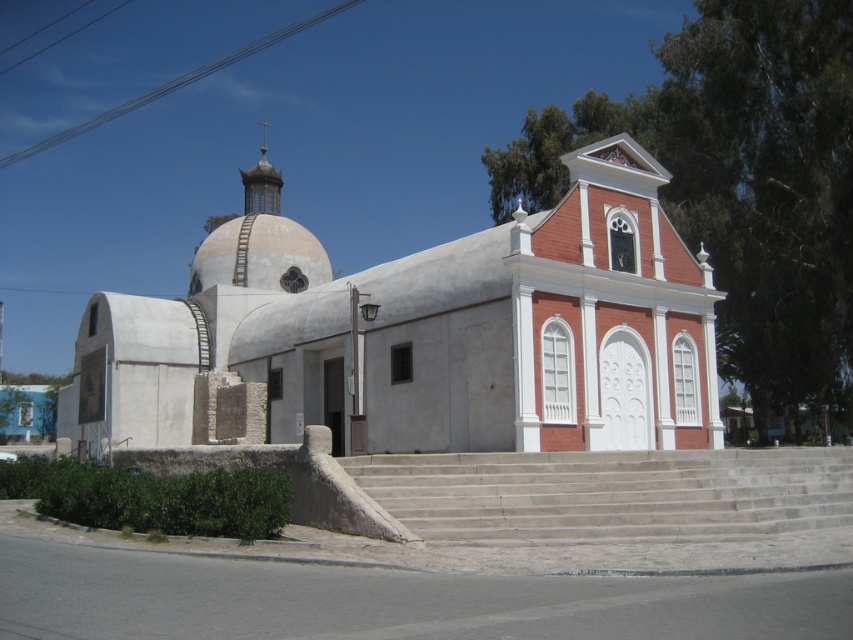
Between white stucco chapel at center and gray concrete stairs at center, which one has less height?

gray concrete stairs at center

Who is positioned more to the left, white stucco chapel at center or gray concrete stairs at center?

From the viewer's perspective, white stucco chapel at center appears more on the left side.

Who is more distant from viewer, (76, 353) or (676, 490)?

Point (76, 353)

Find the location of `white stucco chapel at center`. white stucco chapel at center is located at coordinates (427, 332).